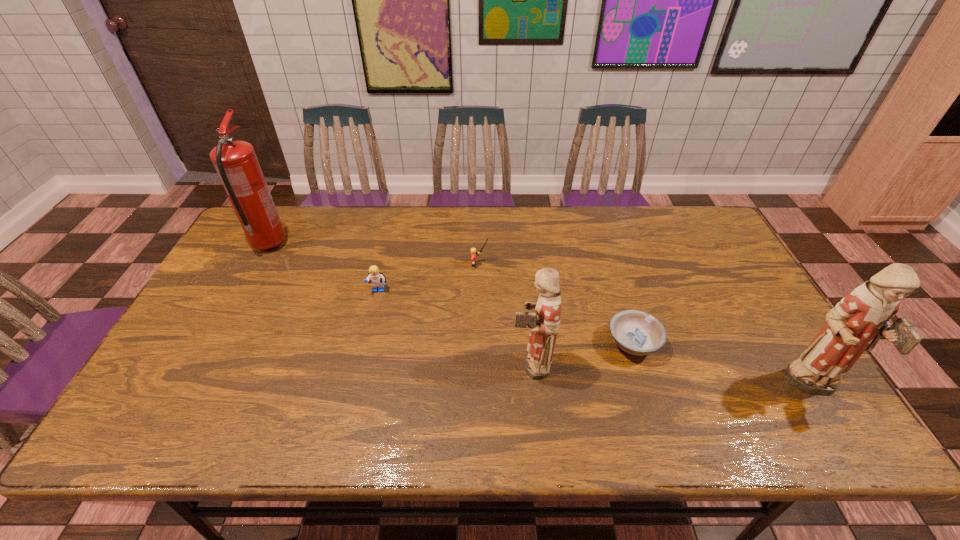
Considering the uniform spacing of figurines, where should an additional figurine be positioned on the left? Please locate a free spot. Please provide its 2D coordinates. Your answer should be formatted as a tuple, i.e. [(x, y)], where the tuple contains the x and y coordinates of a point satisfying the conditions above.

[(271, 340)]